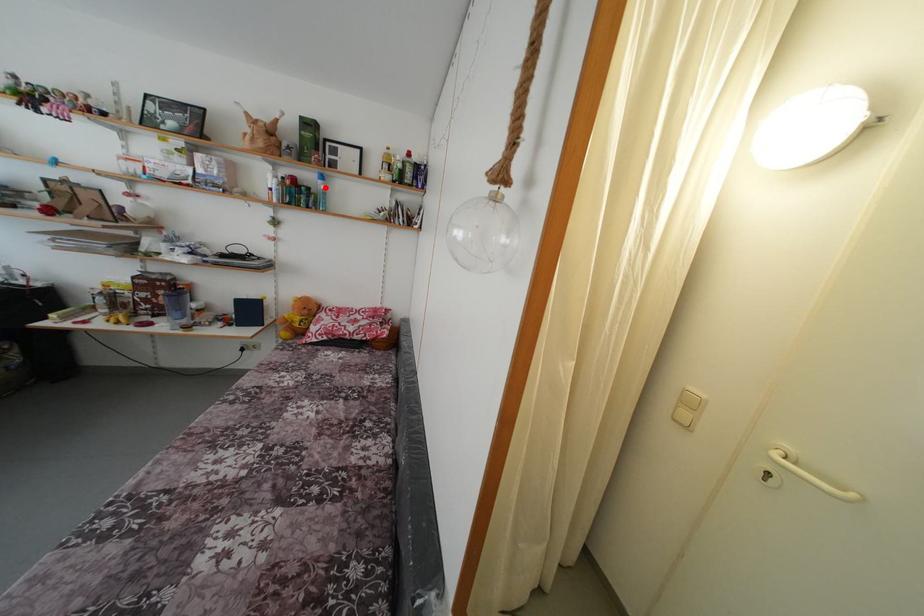
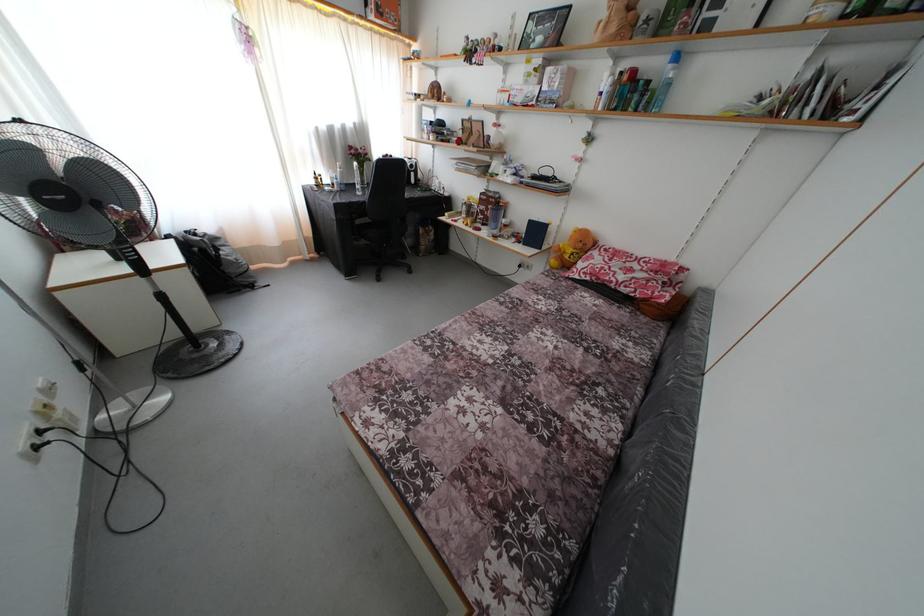
The point at the highlighted location is marked in the first image. Where is the corresponding point in the second image?

(675, 73)